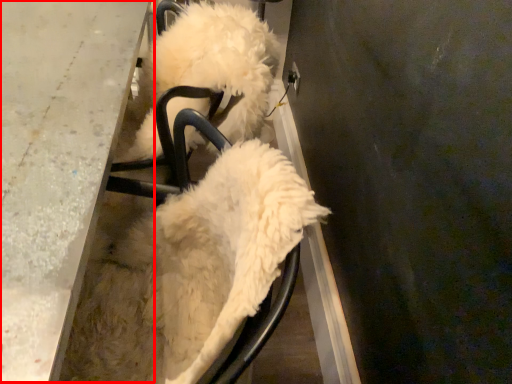
Question: Where is table (annotated by the red box) located in relation to dog in the image?

Choices:
 (A) left
 (B) right

Answer: (A)